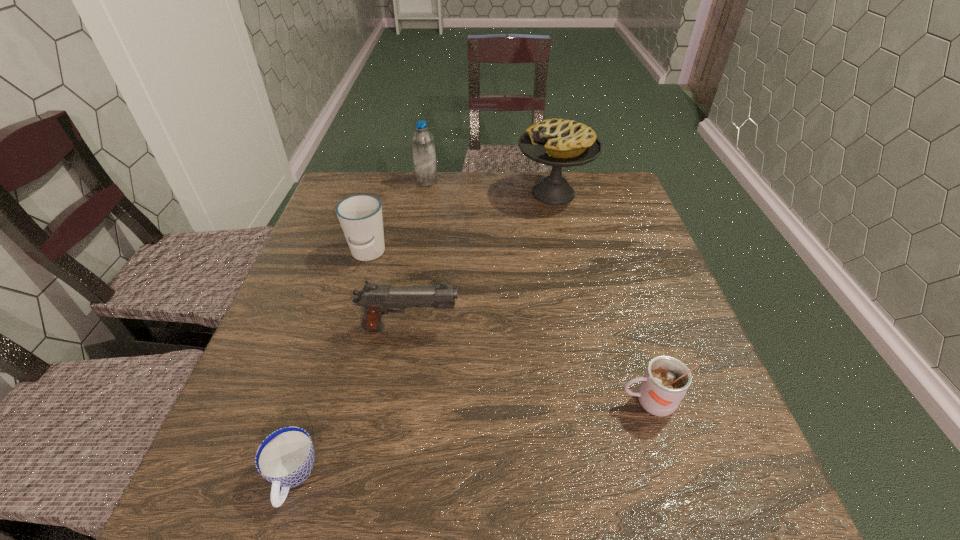
Locate an element on the screen. The image size is (960, 540). blank region between the nearest cup and the water bottle is located at coordinates (360, 330).

At what (x,y) coordinates should I click in order to perform the action: click on vacant region between the pie and the second tallest cup. Please return your answer as a coordinate pair (x, y). Looking at the image, I should click on tap(601, 298).

You are a GUI agent. You are given a task and a screenshot of the screen. Output one action in this format:
    pyautogui.click(x=<x>, y=<y>)
    Task: Click on the empty space that is in between the pie and the water bottle
    
    Given the screenshot: What is the action you would take?
    pyautogui.click(x=490, y=187)

I want to click on vacant area between the second nearest cup and the third nearest object, so click(x=530, y=365).

You are a GUI agent. You are given a task and a screenshot of the screen. Output one action in this format:
    pyautogui.click(x=<x>, y=<y>)
    Task: Click on the unoccupied area between the nearest cup and the second nearest object
    The image size is (960, 540).
    Given the screenshot: What is the action you would take?
    pyautogui.click(x=471, y=441)

The height and width of the screenshot is (540, 960). In order to click on empty space that is in between the fourth farthest object and the second tallest cup in this screenshot , I will do `click(530, 365)`.

Identify the location of blank region between the pie and the second nearest cup. (601, 298).

Find the location of `empty location between the second shortest cup and the third nearest object`. empty location between the second shortest cup and the third nearest object is located at coordinates (530, 365).

Find the location of a particular element. This screenshot has height=540, width=960. unoccupied area between the tallest cup and the water bottle is located at coordinates click(x=397, y=218).

Find the location of a particular element. Image resolution: width=960 pixels, height=540 pixels. blank region between the second nearest cup and the nearest object is located at coordinates (471, 441).